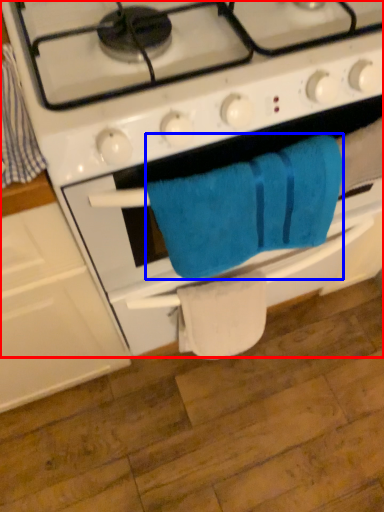
Question: Which object is further to the camera taking this photo, gas stove (highlighted by a red box) or towel/napkin (highlighted by a blue box)?

Choices:
 (A) gas stove
 (B) towel/napkin

Answer: (B)